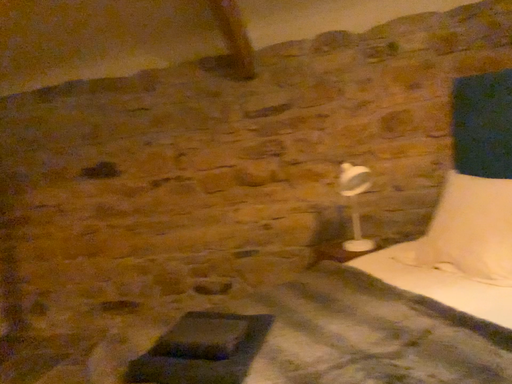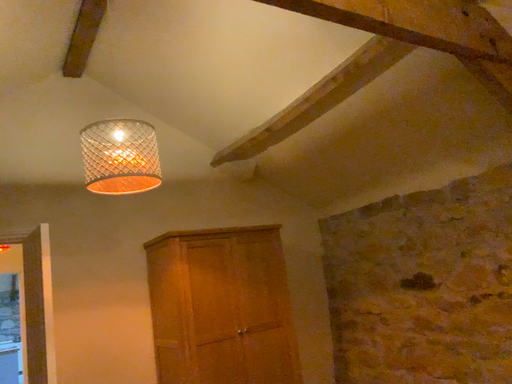
Question: Which way did the camera rotate in the video?

Choices:
 (A) rotated downward
 (B) rotated upward

Answer: (B)